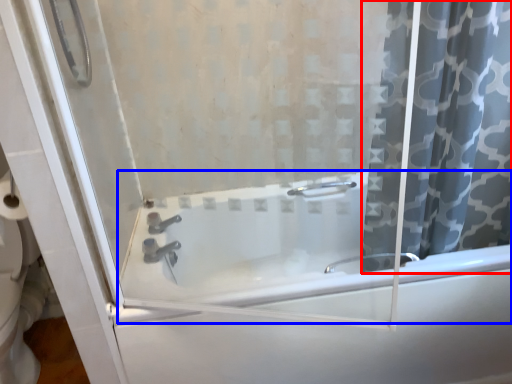
Question: Which object appears closest to the camera in this image, curtain (highlighted by a red box) or bathtub (highlighted by a blue box)?

Choices:
 (A) curtain
 (B) bathtub

Answer: (A)